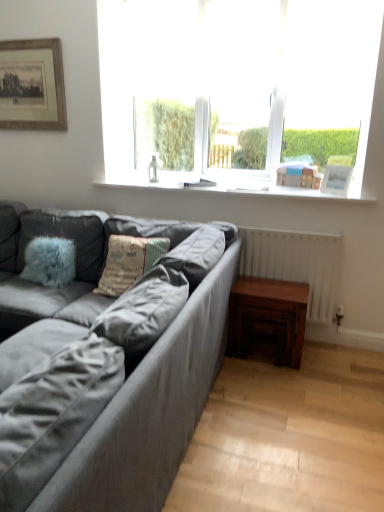
Find the location of `free point in front of white glossy picture frame at upper right, the 1th picture frame when ordered from right to left`. free point in front of white glossy picture frame at upper right, the 1th picture frame when ordered from right to left is located at coordinates (352, 197).